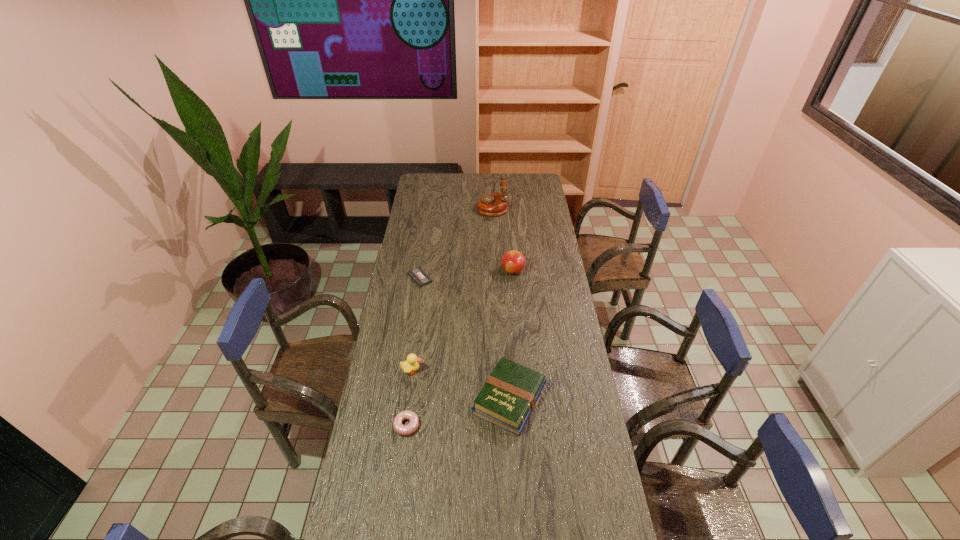
Image resolution: width=960 pixels, height=540 pixels. In order to click on free space at the left edge in this screenshot , I will do `click(383, 527)`.

In the image, there is a desktop. What are the coordinates of `vacant space at the right edge` in the screenshot? It's located at (572, 457).

At what (x,y) coordinates should I click in order to perform the action: click on vacant space at the far left corner of the desktop. Please return your answer as a coordinate pair (x, y). This screenshot has height=540, width=960. Looking at the image, I should click on (430, 178).

Where is `free location at the far right corner of the desktop`? free location at the far right corner of the desktop is located at coordinates (522, 186).

Where is `free space between the duckling and the apple`? The image size is (960, 540). free space between the duckling and the apple is located at coordinates (463, 321).

Where is `free space between the shortest object and the duckling`? This screenshot has width=960, height=540. free space between the shortest object and the duckling is located at coordinates (416, 325).

This screenshot has height=540, width=960. In order to click on empty space between the tallest object and the book in this screenshot , I will do `click(501, 302)`.

The height and width of the screenshot is (540, 960). I want to click on free space between the tallest object and the book, so tap(501, 302).

Image resolution: width=960 pixels, height=540 pixels. What are the coordinates of `free space between the apple and the farthest object` in the screenshot? It's located at (503, 239).

The width and height of the screenshot is (960, 540). Find the location of `vacant point located between the duckling and the apple`. vacant point located between the duckling and the apple is located at coordinates (463, 321).